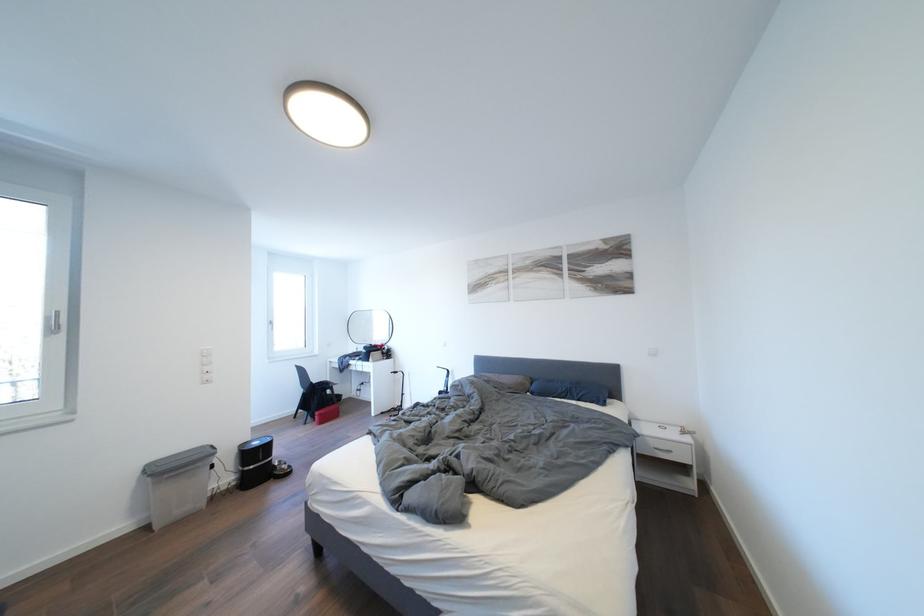
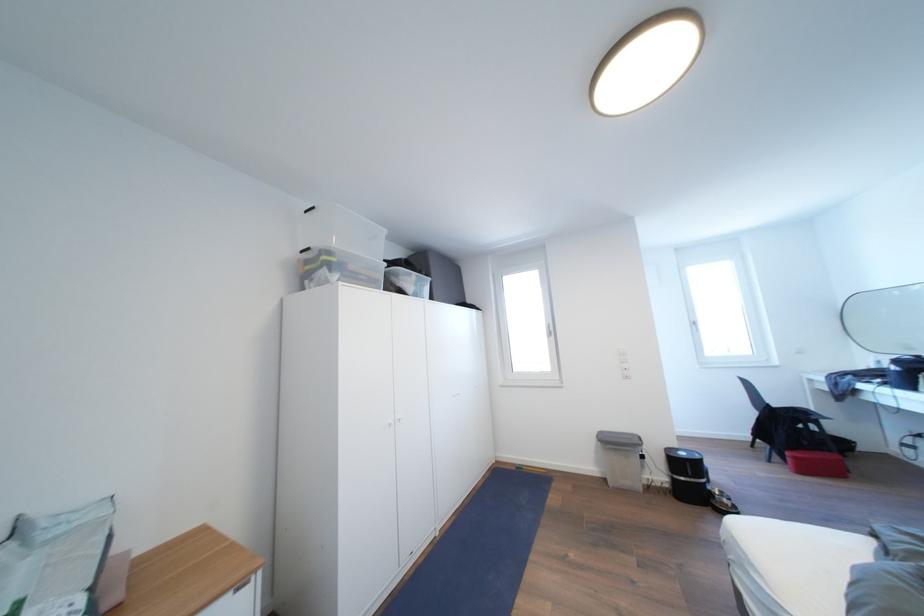
Where in the second image is the point corresponding to point (329, 419) from the first image?

(803, 463)